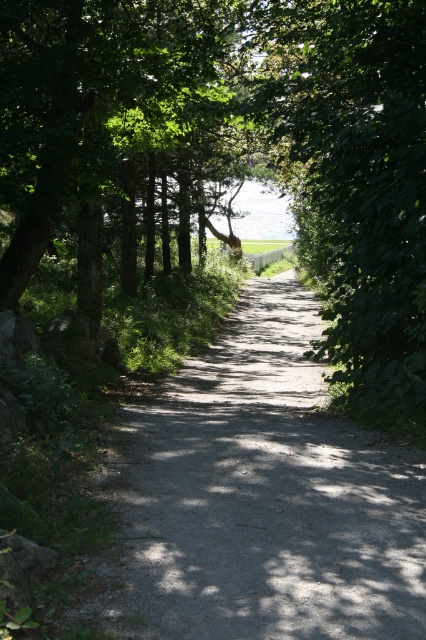
You are standing at the starting point of the dirt path. You want to reach the water in the background. Which direction should you walk relative to the green leafy tree at center?

Walk towards the green leafy tree at center because the water is in the background beyond the tree.